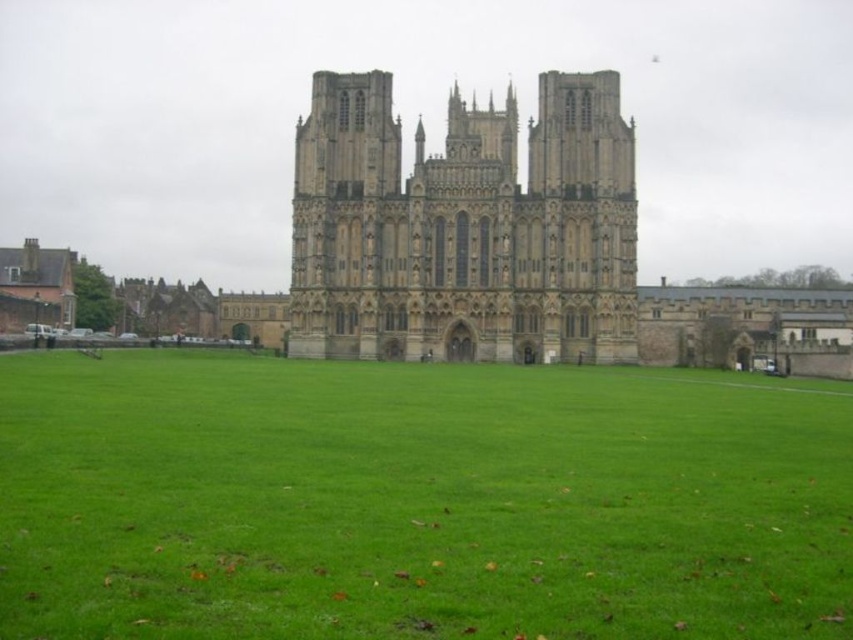
Question: Can you confirm if green grass at center is bigger than stone gothic cathedral at center?

Choices:
 (A) no
 (B) yes

Answer: (B)

Question: Observing the image, what is the correct spatial positioning of green grass at center in reference to stone gothic cathedral at center?

Choices:
 (A) left
 (B) right

Answer: (A)

Question: Among these points, which one is farthest from the camera?

Choices:
 (A) coord(424,630)
 (B) coord(590,250)

Answer: (B)

Question: Is green grass at center closer to camera compared to stone gothic cathedral at center?

Choices:
 (A) yes
 (B) no

Answer: (A)

Question: Which of the following is the closest to the observer?

Choices:
 (A) (543, 209)
 (B) (833, 428)

Answer: (B)